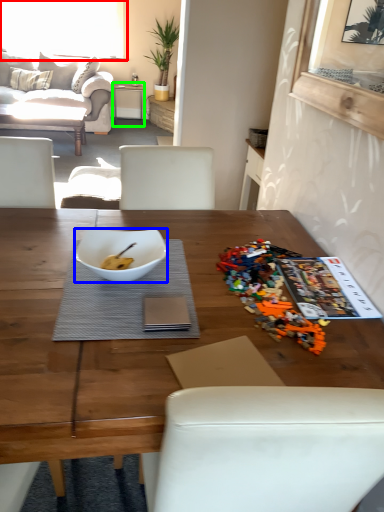
Question: Estimate the real-world distances between objects in this image. Which object is farther from window (highlighted by a red box), bowl (highlighted by a blue box) or table (highlighted by a green box)?

Choices:
 (A) bowl
 (B) table

Answer: (A)